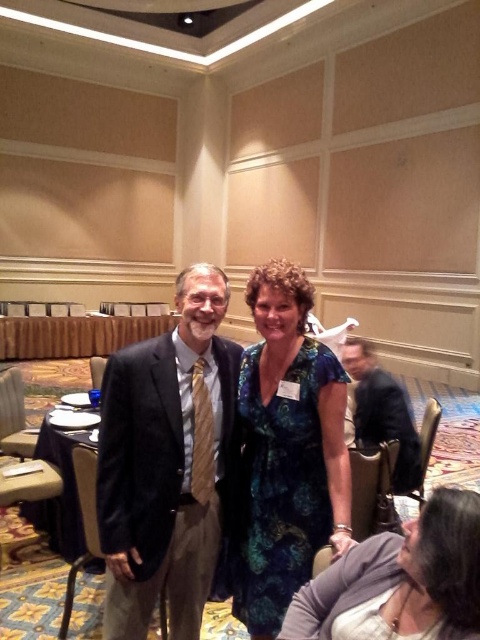
Question: Does velvet black suit at center appear on the left side of floral dress at center?

Choices:
 (A) yes
 (B) no

Answer: (A)

Question: Which of the following is the closest to the observer?

Choices:
 (A) (183, 355)
 (B) (399, 483)
 (C) (292, 397)

Answer: (C)

Question: Which point is closer to the camera taking this photo?

Choices:
 (A) (275, 632)
 (B) (427, 532)
 (C) (181, 285)
 (D) (376, 426)

Answer: (B)

Question: Which point is closer to the camera?

Choices:
 (A) dark suit at right
 (B) velvet black suit at center
 (C) floral dress at center
 (D) blue floral dress at center

Answer: (C)

Question: Does velvet black suit at center have a lesser width compared to floral dress at center?

Choices:
 (A) no
 (B) yes

Answer: (A)

Question: Does blue floral dress at center have a smaller size compared to floral dress at center?

Choices:
 (A) no
 (B) yes

Answer: (A)